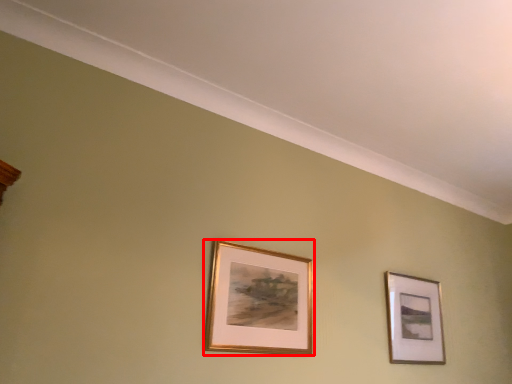
Question: From the image's perspective, considering the relative positions of picture frame (annotated by the red box) and picture frame in the image provided, where is picture frame (annotated by the red box) located with respect to the staircase?

Choices:
 (A) above
 (B) below

Answer: (A)